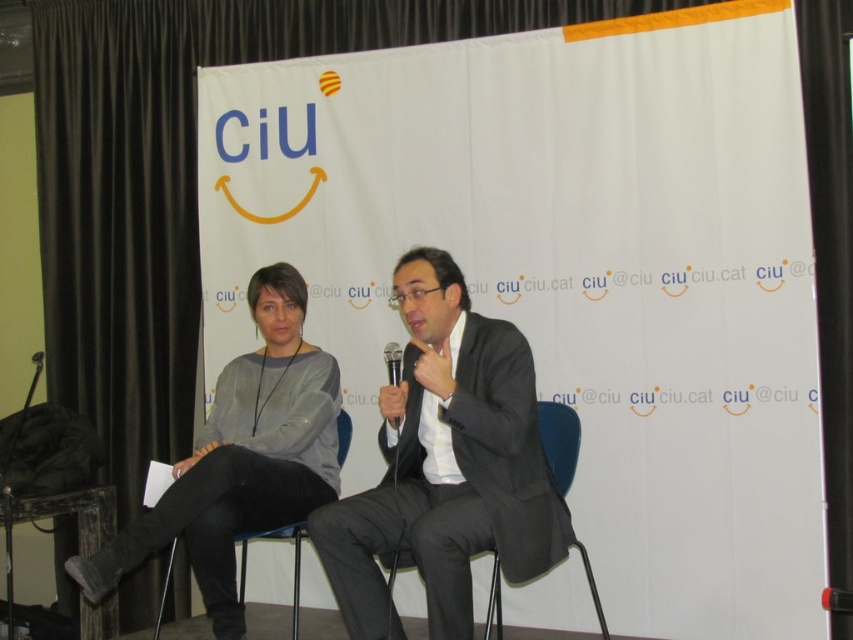
Question: Estimate the real-world distances between objects in this image. Which object is farther from the blue fabric chair at center?

Choices:
 (A) black metallic microphone at center
 (B) dark gray suit at center
 (C) gray sweater at center

Answer: (C)

Question: Which point is closer to the camera taking this photo?

Choices:
 (A) (390, 355)
 (B) (503, 513)

Answer: (B)

Question: Can you confirm if gray sweater at center is thinner than black metallic microphone at center?

Choices:
 (A) yes
 (B) no

Answer: (B)

Question: Can you confirm if blue fabric chair at center is thinner than black plastic chair at lower left?

Choices:
 (A) no
 (B) yes

Answer: (B)

Question: Can you confirm if blue fabric chair at center is positioned above black plastic chair at lower left?

Choices:
 (A) no
 (B) yes

Answer: (B)

Question: Which object is positioned farthest from the blue fabric chair at center?

Choices:
 (A) gray sweater at center
 (B) black metallic microphone at center
 (C) black plastic chair at lower left

Answer: (C)